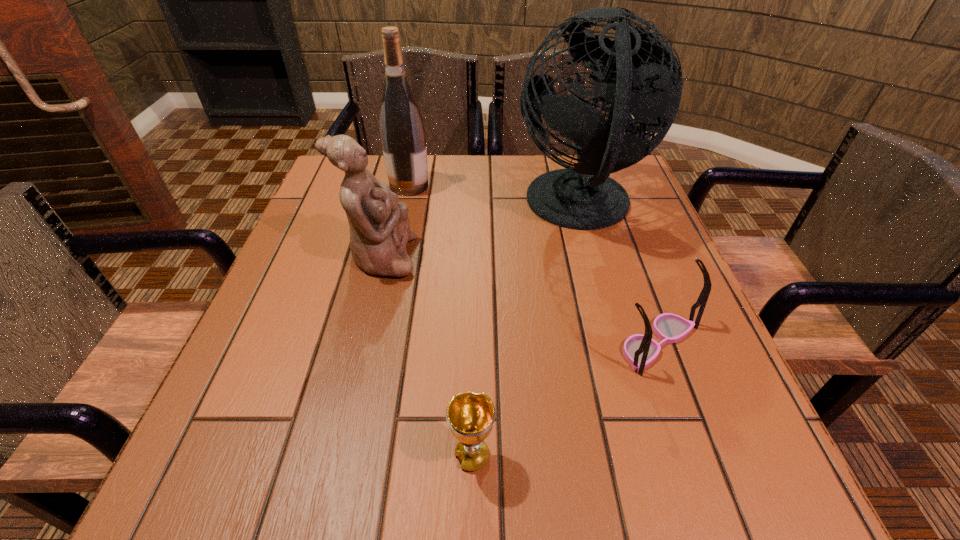
Find the location of `vacant space that satisfies the following two spatial constraints: 1. on the front-facing side of the third tallest object; 2. on the back side of the chalice`. vacant space that satisfies the following two spatial constraints: 1. on the front-facing side of the third tallest object; 2. on the back side of the chalice is located at coordinates (333, 456).

This screenshot has height=540, width=960. Find the location of `vacant region that satisfies the following two spatial constraints: 1. on the front-facing side of the third shortest object; 2. on the back side of the fourth farthest object`. vacant region that satisfies the following two spatial constraints: 1. on the front-facing side of the third shortest object; 2. on the back side of the fourth farthest object is located at coordinates tap(361, 342).

The image size is (960, 540). I want to click on free spot that satisfies the following two spatial constraints: 1. on the back side of the spectacles; 2. on the label of the second tallest object, so click(x=601, y=186).

The image size is (960, 540). Identify the location of vacant space that satisfies the following two spatial constraints: 1. on the front-facing side of the globe; 2. on the front side of the chalice. (649, 456).

You are a GUI agent. You are given a task and a screenshot of the screen. Output one action in this format:
    pyautogui.click(x=<x>, y=<y>)
    Task: Click on the vacant space that satisfies the following two spatial constraints: 1. on the back side of the spectacles; 2. on the front-facing side of the globe
    This screenshot has width=960, height=540.
    Given the screenshot: What is the action you would take?
    pyautogui.click(x=610, y=207)